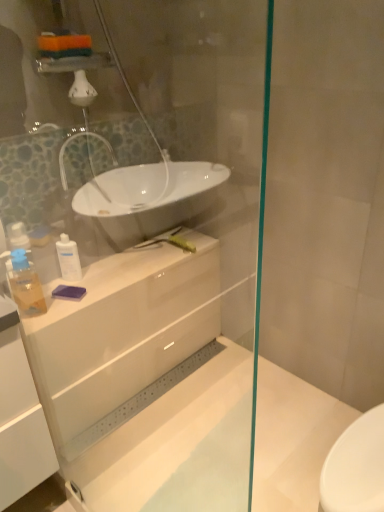
Question: Should I look upward or downward to see white glossy cabinet at center?

Choices:
 (A) down
 (B) up

Answer: (A)

Question: Can you confirm if transparent glass shower door at upper center is thinner than translucent plastic soap dispenser at left, marked as the 2th toiletry in a back-to-front arrangement?

Choices:
 (A) no
 (B) yes

Answer: (B)

Question: Is the depth of transparent glass shower door at upper center less than that of translucent plastic soap dispenser at left, marked as the 2th toiletry in a back-to-front arrangement?

Choices:
 (A) no
 (B) yes

Answer: (B)

Question: Is transparent glass shower door at upper center not inside translucent plastic soap dispenser at left, acting as the first toiletry starting from the left?

Choices:
 (A) yes
 (B) no

Answer: (A)

Question: Does transparent glass shower door at upper center lie behind translucent plastic soap dispenser at left, the 2th toiletry from the right?

Choices:
 (A) yes
 (B) no

Answer: (B)

Question: Can you confirm if transparent glass shower door at upper center is taller than translucent plastic soap dispenser at left, marked as the 2th toiletry in a back-to-front arrangement?

Choices:
 (A) no
 (B) yes

Answer: (B)

Question: From the image's perspective, is transparent glass shower door at upper center located beneath translucent plastic soap dispenser at left, marked as the 2th toiletry in a back-to-front arrangement?

Choices:
 (A) yes
 (B) no

Answer: (A)

Question: Considering the relative sizes of white glossy lotion at center, the 2th toiletry positioned from the front, and translucent plastic soap dispenser at left, acting as the first toiletry starting from the left, in the image provided, is white glossy lotion at center, the 2th toiletry positioned from the front, wider than translucent plastic soap dispenser at left, acting as the first toiletry starting from the left,?

Choices:
 (A) no
 (B) yes

Answer: (A)

Question: Is white glossy lotion at center, the 2th toiletry positioned from the front, far away from translucent plastic soap dispenser at left, acting as the first toiletry starting from the left?

Choices:
 (A) no
 (B) yes

Answer: (A)

Question: From the image's perspective, is white glossy lotion at center, which is the 1th toiletry in right-to-left order, located above translucent plastic soap dispenser at left, the 2th toiletry from the right?

Choices:
 (A) yes
 (B) no

Answer: (A)

Question: Is white glossy lotion at center, which is the 1th toiletry in right-to-left order, next to translucent plastic soap dispenser at left, marked as the 2th toiletry in a back-to-front arrangement, and touching it?

Choices:
 (A) yes
 (B) no

Answer: (B)

Question: Can you confirm if white glossy lotion at center, the first toiletry in the back-to-front sequence, is thinner than translucent plastic soap dispenser at left, marked as the 2th toiletry in a back-to-front arrangement?

Choices:
 (A) yes
 (B) no

Answer: (A)

Question: Considering the relative sizes of white glossy lotion at center, the first toiletry in the back-to-front sequence, and translucent plastic soap dispenser at left, the 2th toiletry from the right, in the image provided, is white glossy lotion at center, the first toiletry in the back-to-front sequence, smaller than translucent plastic soap dispenser at left, the 2th toiletry from the right,?

Choices:
 (A) yes
 (B) no

Answer: (A)

Question: Can you confirm if white glossy lotion at center, the 2th toiletry positioned from the front, is shorter than white glossy cabinet at center?

Choices:
 (A) yes
 (B) no

Answer: (B)